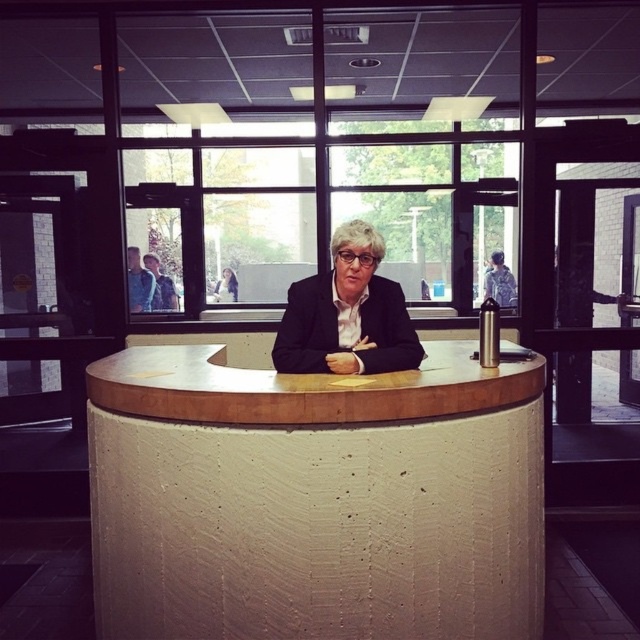
Is point (214, 588) in front of point (300, 371)?

Yes, it is.

Does point (342, 554) lie behind point (323, 337)?

That is False.

This screenshot has width=640, height=640. Identify the location of white textured table at center. (314, 499).